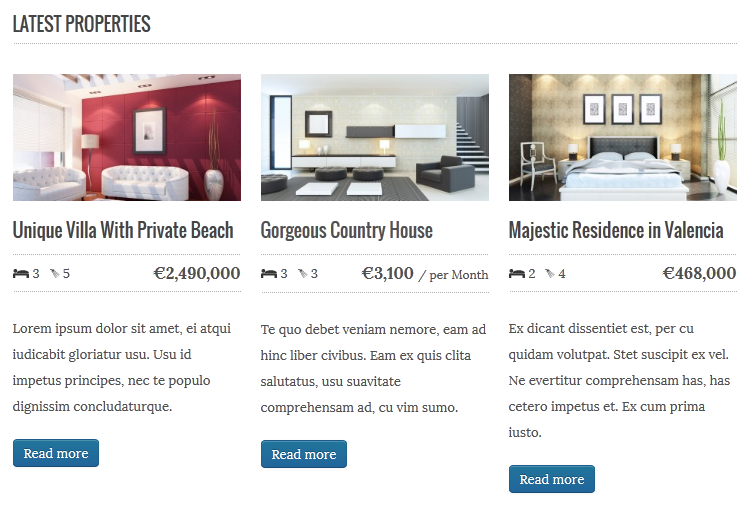
Where is `tan wall`? tan wall is located at coordinates (375, 106), (558, 116).